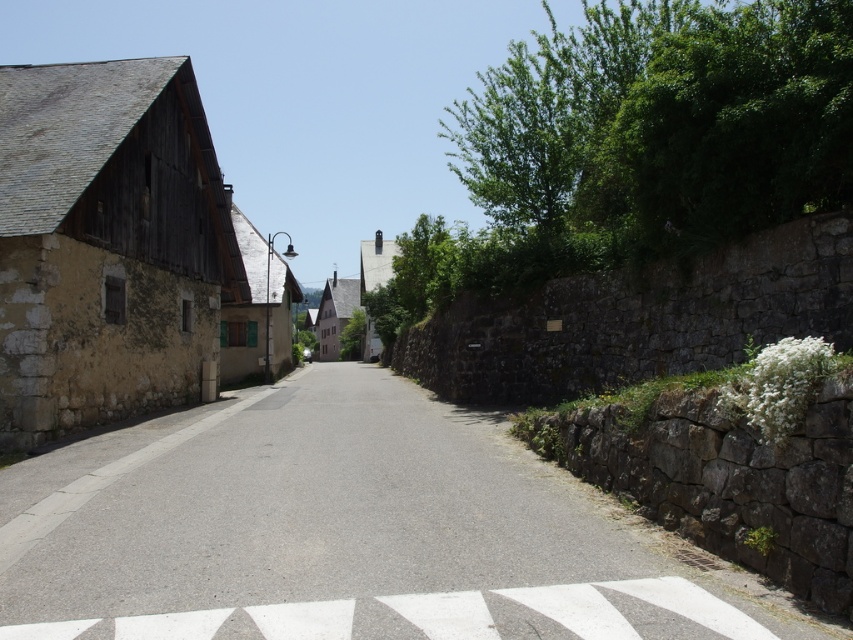
Image resolution: width=853 pixels, height=640 pixels. Identify the location of white textured road marking at center. (636, 598).

Does white textured road marking at center have a greater height compared to metallic street sign at center?

No.

Who is more forward, (601, 625) or (267, 260)?

Point (601, 625)

The width and height of the screenshot is (853, 640). Identify the location of white textured road marking at center. (636, 598).

Is asphalt road at center positioned at the back of white textured road marking at center?

Yes, it is.

Between point (368, 540) and point (315, 621), which one is positioned behind?

The point (368, 540) is behind.

Is point (283, 397) more distant than point (477, 592)?

Yes, it is.

The height and width of the screenshot is (640, 853). Identify the location of asphalt road at center. (347, 532).

Consider the image. Does asphalt road at center have a greater height compared to metallic street sign at center?

Incorrect, asphalt road at center's height is not larger of metallic street sign at center's.

Does asphalt road at center appear on the left side of metallic street sign at center?

No, asphalt road at center is not to the left of metallic street sign at center.

Which is in front, point (529, 474) or point (270, 237)?

Positioned in front is point (529, 474).

Identify the location of asphalt road at center. Image resolution: width=853 pixels, height=640 pixels. pos(347,532).